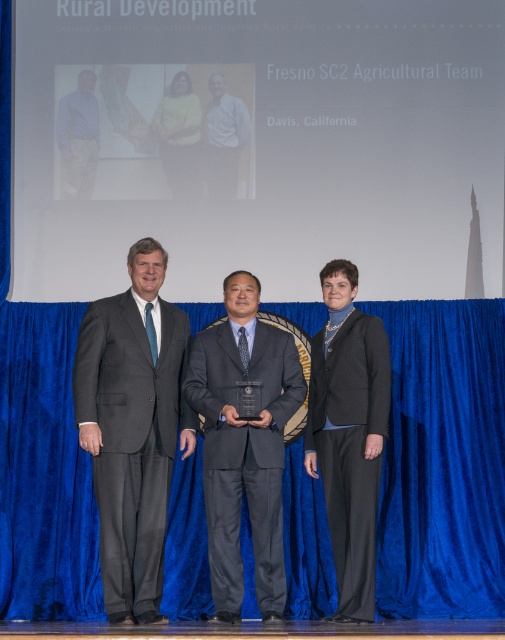
You are a photographer standing at the back of the stage. You want to take a photo of the matte gray suit at center and the matte blue shirt at left such that both are in focus. Your camera has a depth of field that can cover 5 feet. Can you capture both subjects in focus without adjusting your camera settings?

The matte gray suit at center and the matte blue shirt at left are 5.18 feet apart from each other. Since the depth of field can only cover 5 feet, the distance between them exceeds the camera s capability. Therefore, you cannot capture both subjects in focus without adjusting your camera settings.